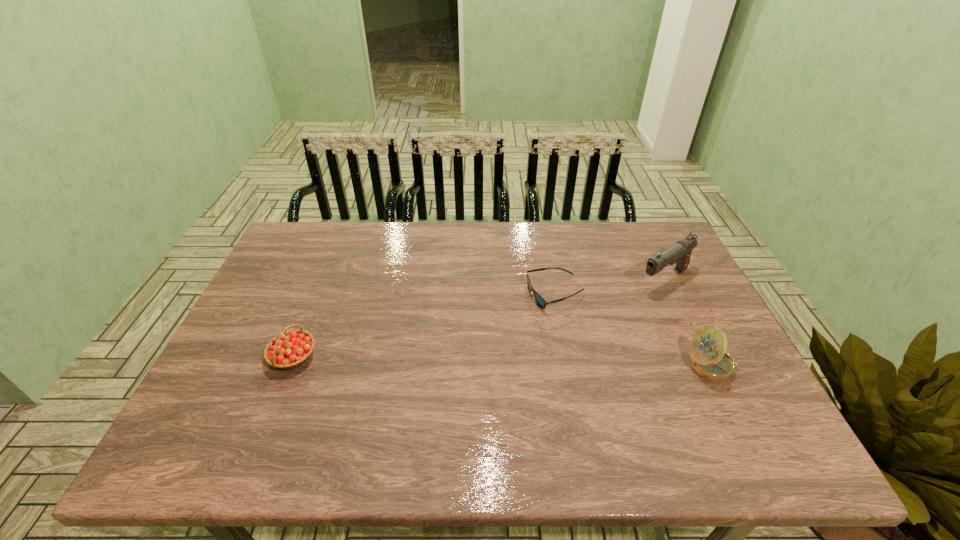
The image size is (960, 540). Find the location of `the leftmost object`. the leftmost object is located at coordinates (290, 349).

You are a GUI agent. You are given a task and a screenshot of the screen. Output one action in this format:
    pyautogui.click(x=<x>, y=<y>)
    Task: Click on the strawberry
    The height and width of the screenshot is (540, 960).
    Given the screenshot: What is the action you would take?
    pos(290,349)

This screenshot has width=960, height=540. Find the location of `the third shortest object`. the third shortest object is located at coordinates (708, 358).

The width and height of the screenshot is (960, 540). What are the coordinates of `gun` in the screenshot? It's located at click(x=680, y=253).

Locate an element on the screen. The image size is (960, 540). the third object from right to left is located at coordinates (541, 302).

Image resolution: width=960 pixels, height=540 pixels. I want to click on sunglasses, so click(x=541, y=302).

Where is `free space located on the back of the leftmost object`? free space located on the back of the leftmost object is located at coordinates (330, 264).

Locate an element on the screen. free space located 0.370m in the direction the gun is aimed is located at coordinates (552, 349).

Identify the location of vacant space located in the direction the gun is aimed. (576, 333).

Locate an element on the screen. Image resolution: width=960 pixels, height=540 pixels. vacant space located in the direction the gun is aimed is located at coordinates (558, 346).